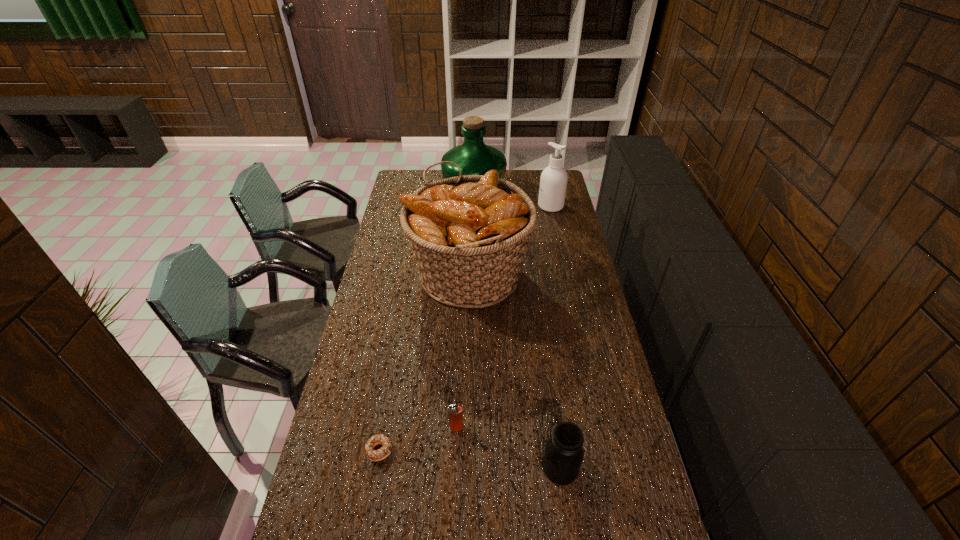
Where is `object that is the second closest one to the fourth tallest object`? The width and height of the screenshot is (960, 540). object that is the second closest one to the fourth tallest object is located at coordinates (374, 455).

Image resolution: width=960 pixels, height=540 pixels. I want to click on object that can be found as the fifth closest to the liquor, so click(x=563, y=455).

The width and height of the screenshot is (960, 540). In order to click on vacant region that satisfies the following two spatial constraints: 1. on the back side of the doughnut; 2. on the right side of the fifth tallest object in this screenshot , I will do `click(383, 428)`.

In order to click on vacant position in the image that satisfies the following two spatial constraints: 1. on the label side of the third shortest object; 2. on the left side of the liquor in this screenshot , I will do `click(469, 468)`.

Find the location of a particular element. free location that satisfies the following two spatial constraints: 1. on the label side of the liquor; 2. on the front side of the doughnut is located at coordinates (469, 450).

Find the location of a particular element. This screenshot has width=960, height=540. free spot that satisfies the following two spatial constraints: 1. on the label side of the liquor; 2. on the back side of the jar is located at coordinates (469, 468).